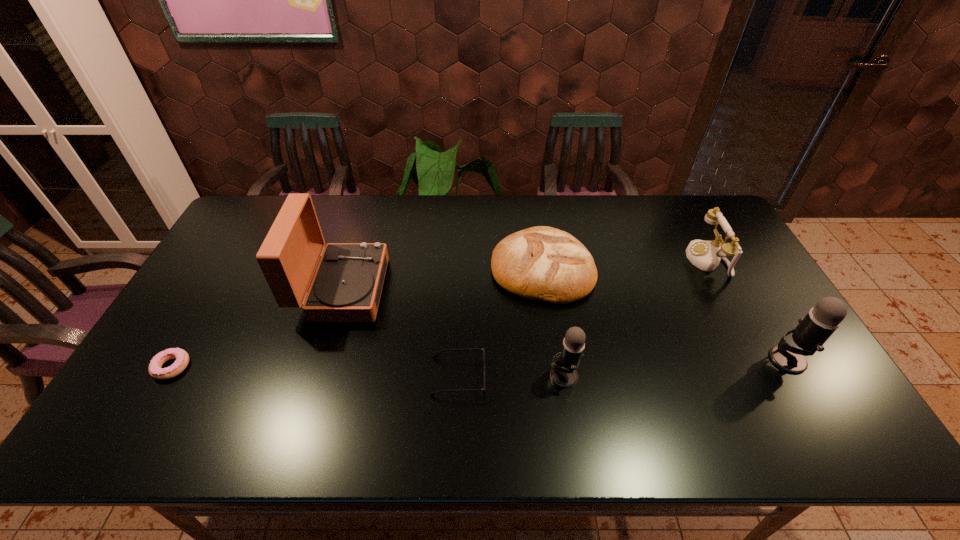
At what (x,y) coordinates should I click in order to perform the action: click on spectacles located at the near edge. Please return your answer as a coordinate pair (x, y). The width and height of the screenshot is (960, 540). Looking at the image, I should click on (435, 356).

Identify the location of object that is at the left edge. (182, 358).

You are a GUI agent. You are given a task and a screenshot of the screen. Output one action in this format:
    pyautogui.click(x=<x>, y=<y>)
    Task: Click on the microphone present at the right edge
    The image size is (960, 540).
    Given the screenshot: What is the action you would take?
    pyautogui.click(x=813, y=330)

Where is `telephone that is positioned at the right edge`? The image size is (960, 540). telephone that is positioned at the right edge is located at coordinates (706, 255).

Where is `object that is at the near left corner`? The image size is (960, 540). object that is at the near left corner is located at coordinates (182, 358).

Where is `object positioned at the near right corner`? Image resolution: width=960 pixels, height=540 pixels. object positioned at the near right corner is located at coordinates (813, 330).

This screenshot has height=540, width=960. Find the location of `free location at the far edge`. free location at the far edge is located at coordinates (630, 208).

Identify the location of vacant area at the near edge. tap(263, 373).

In the image, there is a desktop. Identify the location of vacant region at the left edge. Image resolution: width=960 pixels, height=540 pixels. (255, 262).

At what (x,y) coordinates should I click in order to perform the action: click on vacant space at the right edge of the desktop. Please return your answer as a coordinate pair (x, y). The width and height of the screenshot is (960, 540). Looking at the image, I should click on click(x=776, y=319).